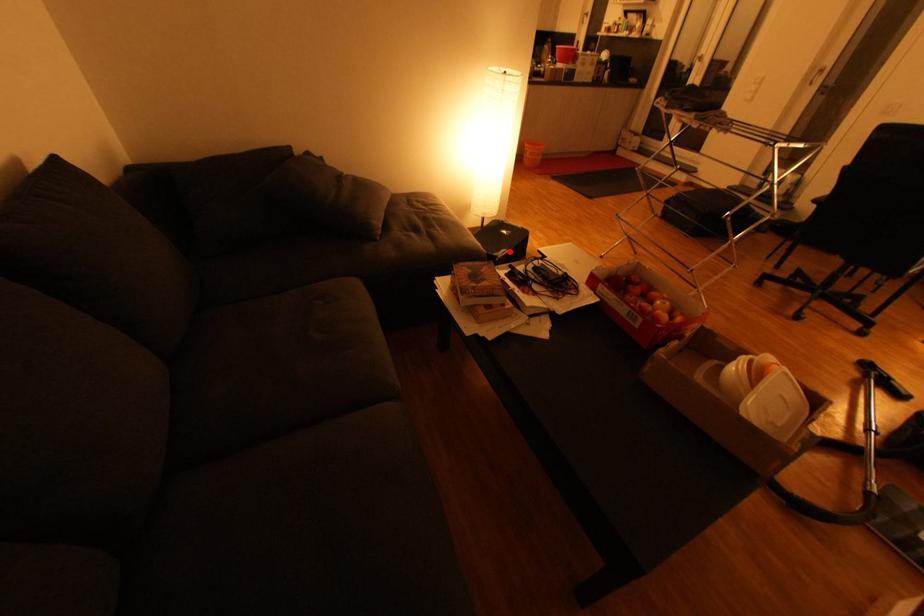
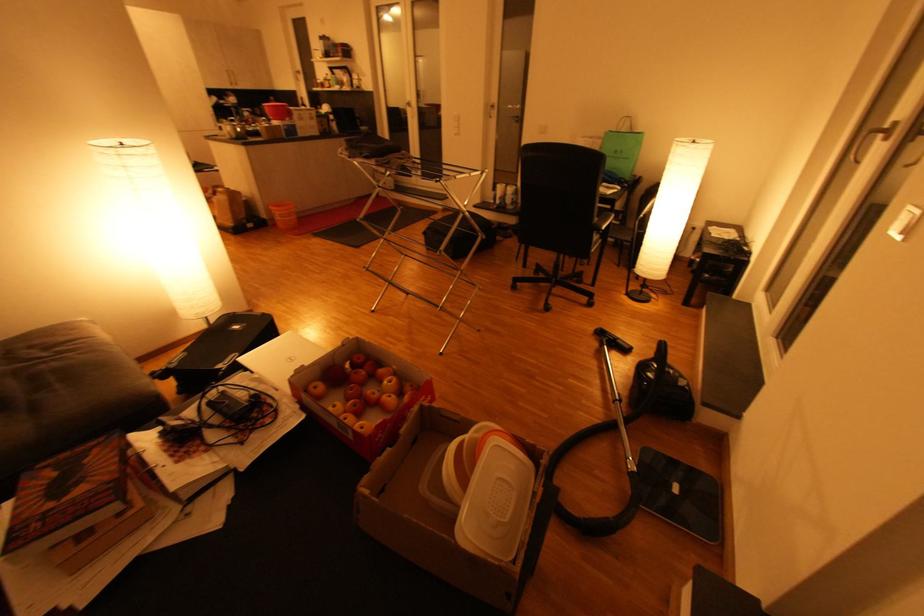
Question: I am providing you with two images of the same scene from different viewpoints. A red point is marked on the first image. Can you still see the location of the red point in image 2?

Choices:
 (A) Yes
 (B) No

Answer: (A)